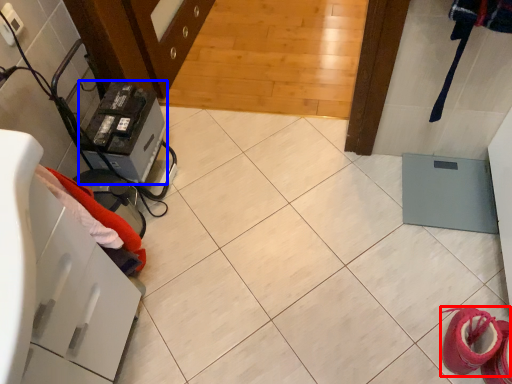
Question: Which of the following is the farthest to the observer, footwear (highlighted by a red box) or appliance (highlighted by a blue box)?

Choices:
 (A) footwear
 (B) appliance

Answer: (B)